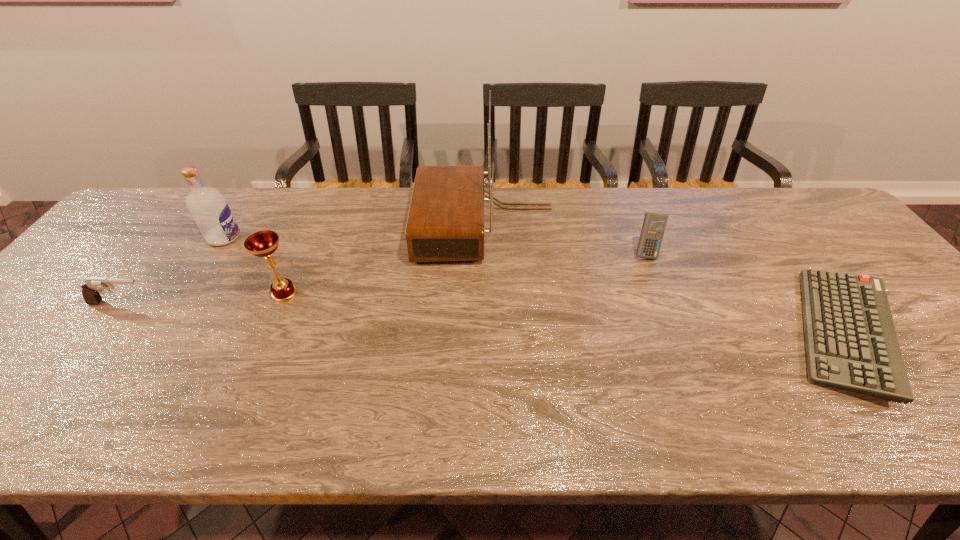
The width and height of the screenshot is (960, 540). Identify the location of the tallest object. coord(445,222).

In order to click on the third object from right to left in this screenshot , I will do (x=445, y=222).

Locate an element on the screen. The width and height of the screenshot is (960, 540). vodka is located at coordinates (209, 209).

Locate an element on the screen. The height and width of the screenshot is (540, 960). the second object from left to right is located at coordinates (209, 209).

The width and height of the screenshot is (960, 540). I want to click on the fourth object from right to left, so [x=264, y=243].

I want to click on chalice, so click(x=264, y=243).

At what (x,y) coordinates should I click in order to perform the action: click on calculator. Please return your answer as a coordinate pair (x, y). The height and width of the screenshot is (540, 960). Looking at the image, I should click on (654, 224).

I want to click on the second object from right to left, so click(654, 224).

This screenshot has width=960, height=540. In order to click on gun in this screenshot , I will do `click(93, 286)`.

Identify the location of the leftmost object. (93, 286).